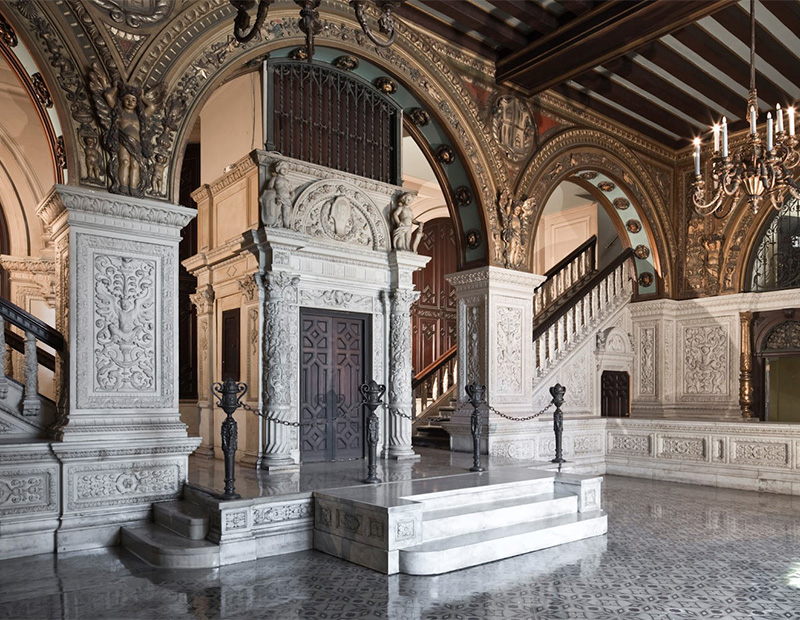
What are the coordinates of `front of archways` in the screenshot? It's located at (32, 23), (433, 90), (585, 152).